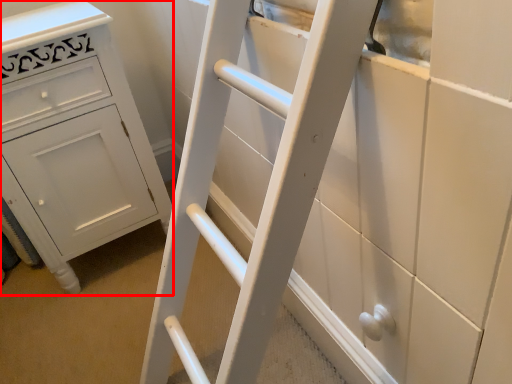
Question: Where is chest of drawers (annotated by the red box) located in relation to ladder in the image?

Choices:
 (A) right
 (B) left

Answer: (B)